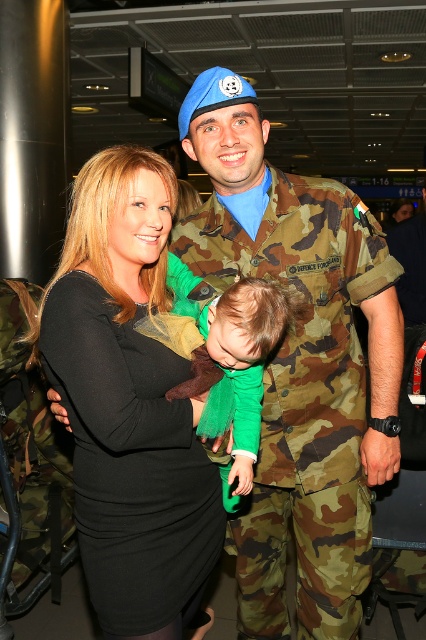
Can you confirm if camouflage uniform at center is taller than black matte dress at center?

Yes.

Is camouflage uniform at center shorter than black matte dress at center?

In fact, camouflage uniform at center may be taller than black matte dress at center.

Locate an element on the screen. This screenshot has width=426, height=640. camouflage uniform at center is located at coordinates (299, 362).

At what (x,y) coordinates should I click in order to perform the action: click on camouflage uniform at center. Please return your answer as a coordinate pair (x, y). This screenshot has height=640, width=426. Looking at the image, I should click on (299, 362).